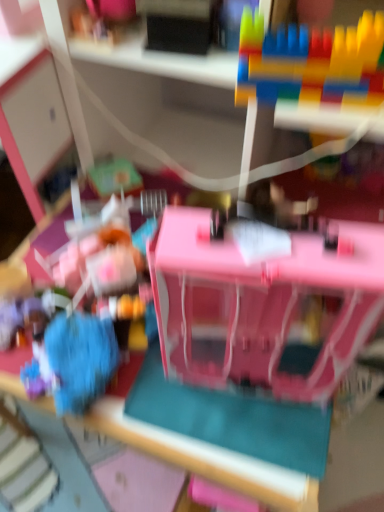
The width and height of the screenshot is (384, 512). Find the location of `unoccupied area in front of pink plastic dollhouse at center, the second toy viewed from the right`. unoccupied area in front of pink plastic dollhouse at center, the second toy viewed from the right is located at coordinates (253, 436).